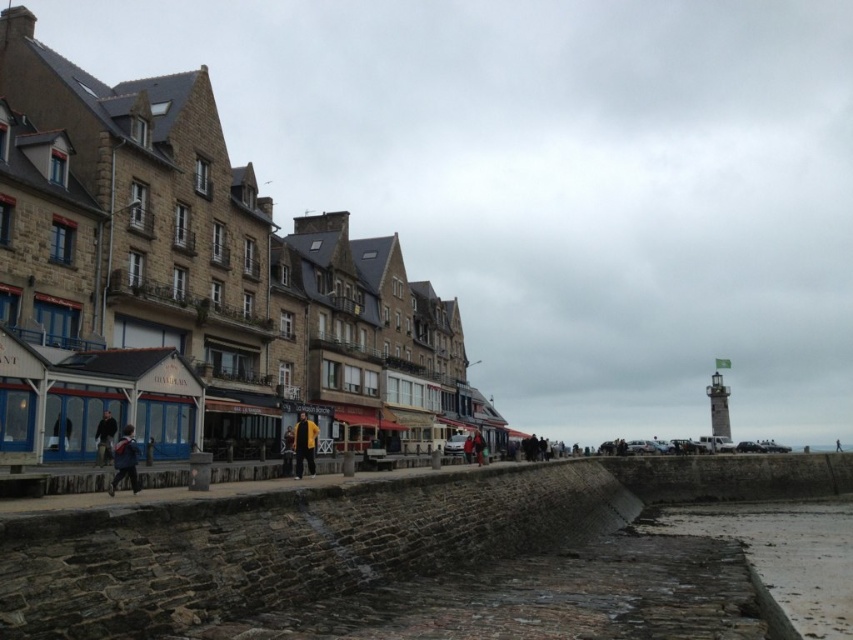
From the picture: You are a photographer standing on the waterfront and want to capture both the yellow fabric jacket at center and the red jacket at center in a single frame. Which jacket will appear wider in the photo?

The yellow fabric jacket at center will appear wider in the photo because its width surpasses that of the red jacket at center.

You are a tourist walking along the coastal promenade and notice two people wearing jackets. One is wearing a yellow fabric jacket at center and the other a dark blue jacket at center. From your perspective, which jacket is closer to you?

The yellow fabric jacket at center is closer because it is positioned in front of the dark blue jacket at center.